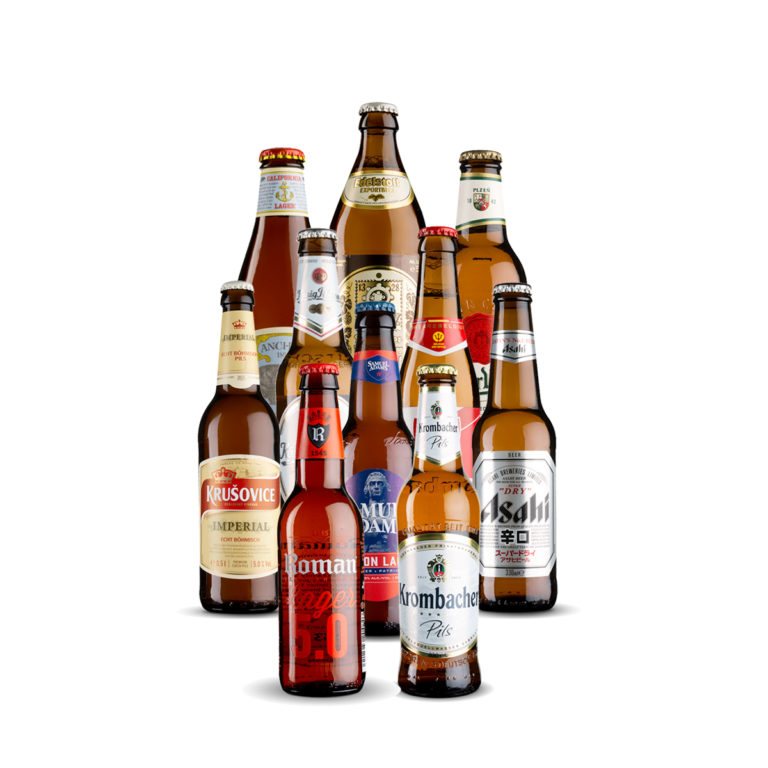
This screenshot has width=768, height=768. In order to click on beer bottles in this screenshot , I will do `click(240, 462)`, `click(305, 555)`, `click(384, 477)`, `click(441, 525)`, `click(522, 462)`, `click(437, 323)`, `click(325, 303)`, `click(260, 227)`, `click(349, 194)`, `click(485, 217)`.